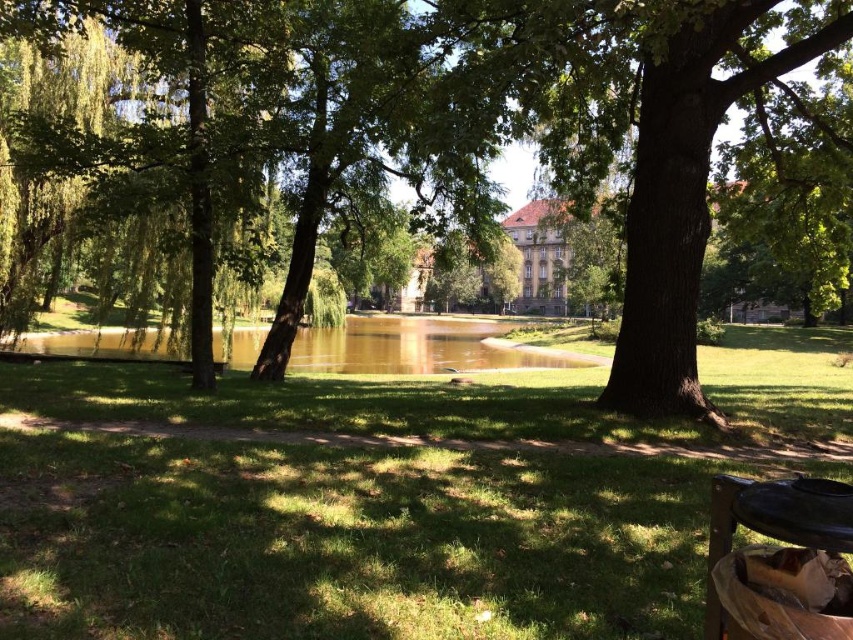
Does green leafy tree at center have a lesser width compared to black wood picnic table at lower right?

No, green leafy tree at center is not thinner than black wood picnic table at lower right.

Is point (299, 134) behind point (822, 513)?

Yes, it is behind point (822, 513).

The image size is (853, 640). What are the coordinates of `green leafy tree at center` in the screenshot? It's located at (556, 132).

The height and width of the screenshot is (640, 853). I want to click on green leafy tree at center, so click(x=556, y=132).

Who is lower down, green grass at center or green leafy tree at center?

Positioned lower is green grass at center.

Between green grass at center and green leafy tree at center, which one is positioned higher?

green leafy tree at center is above.

In order to click on green grass at center in this screenshot , I will do (x=346, y=513).

Can you confirm if brown liquid water at center is bigger than black wood picnic table at lower right?

Yes, brown liquid water at center is bigger than black wood picnic table at lower right.

Is point (379, 362) closer to camera compared to point (769, 513)?

No, it is behind (769, 513).

Where is `brown liquid water at center`? brown liquid water at center is located at coordinates (415, 346).